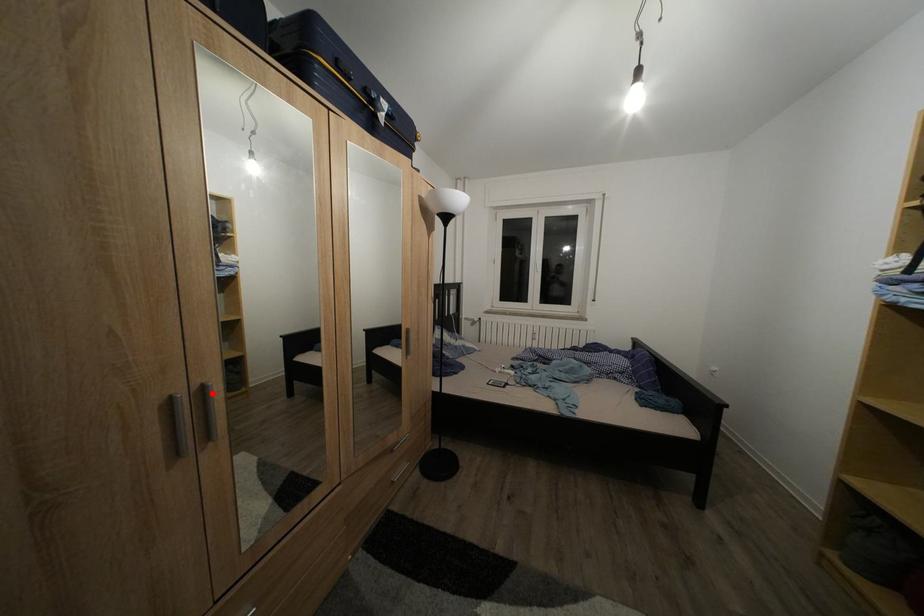
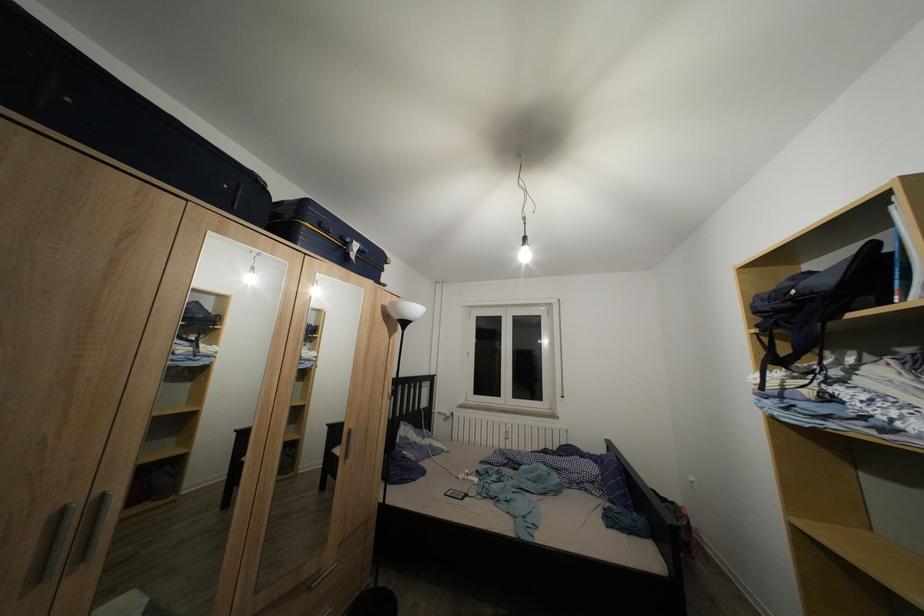
Question: I am providing you with two images of the same scene from different viewpoints. Given a red point in image1, look at the same physical point in image2. Is it:

Choices:
 (A) Closer to the viewpoint
 (B) Farther from the viewpoint

Answer: (B)